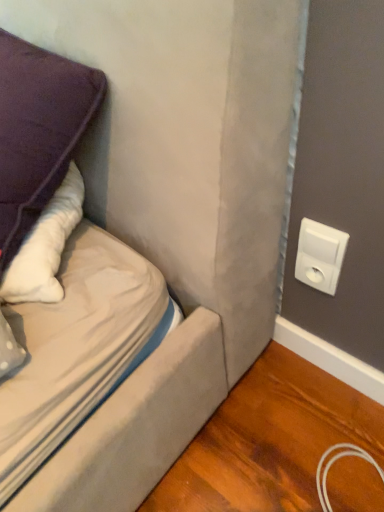
Question: Based on their sizes in the image, would you say white plastic outlet at upper right is bigger or smaller than purple fabric pillow at upper left?

Choices:
 (A) small
 (B) big

Answer: (A)

Question: Based on their positions, is white plastic outlet at upper right located to the left or right of purple fabric pillow at upper left?

Choices:
 (A) left
 (B) right

Answer: (B)

Question: Choose the correct answer: Is white plastic outlet at upper right inside purple fabric pillow at upper left or outside it?

Choices:
 (A) outside
 (B) inside

Answer: (A)

Question: In the image, is purple fabric pillow at upper left on the left side or the right side of white plastic outlet at upper right?

Choices:
 (A) left
 (B) right

Answer: (A)

Question: From a real-world perspective, is purple fabric pillow at upper left above or below white plastic outlet at upper right?

Choices:
 (A) above
 (B) below

Answer: (A)

Question: From the image's perspective, is purple fabric pillow at upper left above or below white plastic outlet at upper right?

Choices:
 (A) above
 (B) below

Answer: (A)

Question: Is point (29, 60) closer or farther from the camera than point (316, 249)?

Choices:
 (A) closer
 (B) farther

Answer: (A)